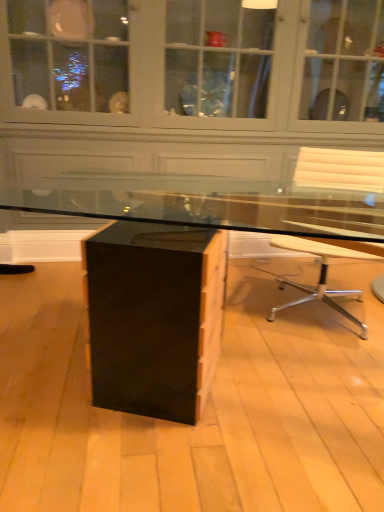
Find the location of a particular element. The width and height of the screenshot is (384, 512). vacant space underneath matte black desk at center (from a real-world perspective) is located at coordinates (292, 382).